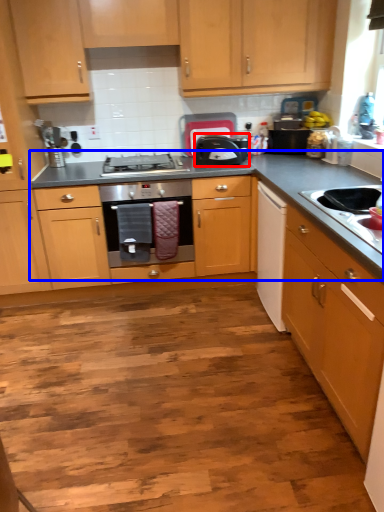
Question: Which object is closer to the camera taking this photo, kitchen appliance (highlighted by a red box) or countertop (highlighted by a blue box)?

Choices:
 (A) kitchen appliance
 (B) countertop

Answer: (B)